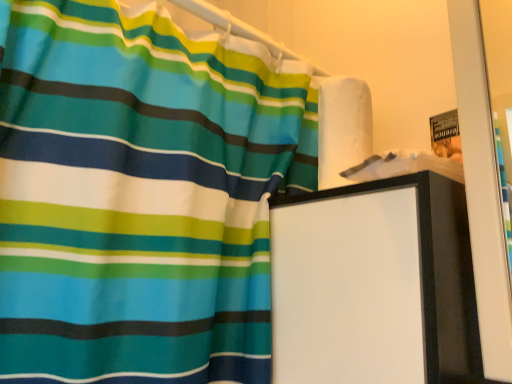
Image resolution: width=512 pixels, height=384 pixels. What do you see at coordinates (342, 127) in the screenshot? I see `white matte toilet paper at upper right` at bounding box center [342, 127].

The width and height of the screenshot is (512, 384). In order to click on white matte toilet paper at upper right in this screenshot , I will do `click(342, 127)`.

Where is `white matte toilet paper at upper right`? white matte toilet paper at upper right is located at coordinates (342, 127).